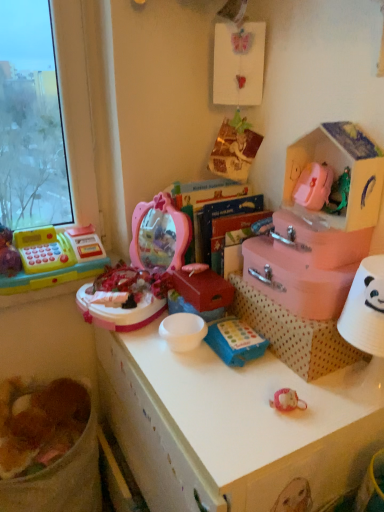
Find the location of a particular element. This screenshot has width=384, height=512. free point below matte plastic cash register at left, which is the second toy in front-to-back order (from a real-world perspective) is located at coordinates (x=57, y=284).